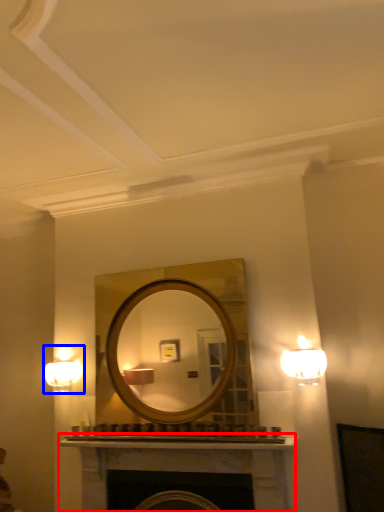
Question: Which of the following is the farthest to the observer, fireplace (highlighted by a red box) or fixture (highlighted by a blue box)?

Choices:
 (A) fireplace
 (B) fixture

Answer: (B)